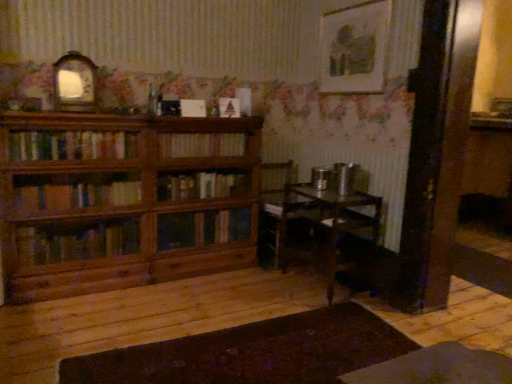
The image size is (512, 384). Identify the location of free space between wooden chair at center and wooden bookcase at left. (191, 281).